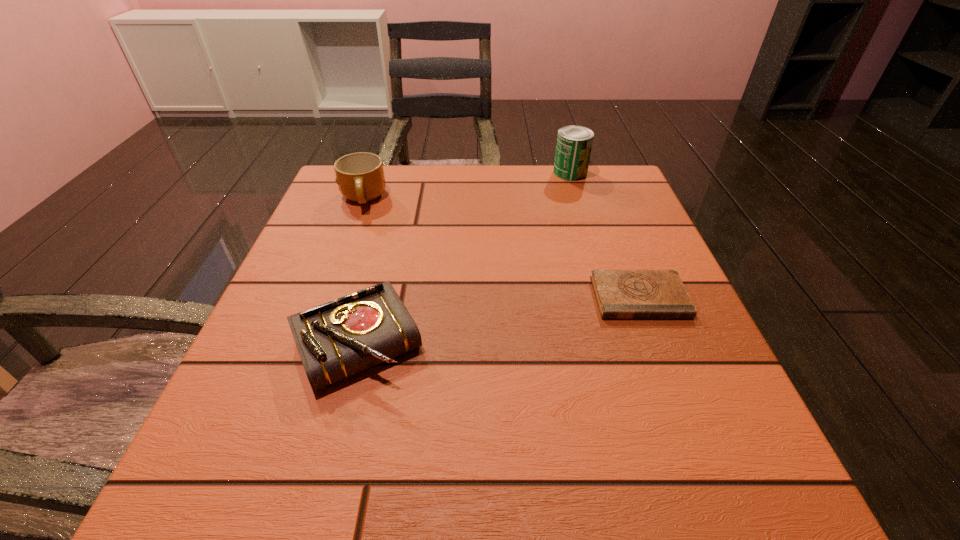
Image resolution: width=960 pixels, height=540 pixels. I want to click on can, so click(574, 143).

This screenshot has height=540, width=960. What are the coordinates of `the tallest object` in the screenshot? It's located at (574, 143).

This screenshot has width=960, height=540. Find the location of `mug`. mug is located at coordinates (360, 177).

Identify the location of the second farthest object. (360, 177).

Find the location of `the taller diary`. the taller diary is located at coordinates (335, 340).

What are the coordinates of `the left diary` in the screenshot? It's located at (335, 340).

Locate an element on the screen. Image resolution: width=960 pixels, height=540 pixels. the shortest object is located at coordinates (620, 294).

Image resolution: width=960 pixels, height=540 pixels. I want to click on the right diary, so click(620, 294).

At what (x,y) coordinates should I click in order to perform the action: click on vacant space located on the right of the farthest object. Please return your answer as a coordinate pair (x, y). This screenshot has width=960, height=540. Looking at the image, I should click on (626, 172).

The image size is (960, 540). Identify the location of vacant space positioned on the side with the handle of the mug. click(x=351, y=230).